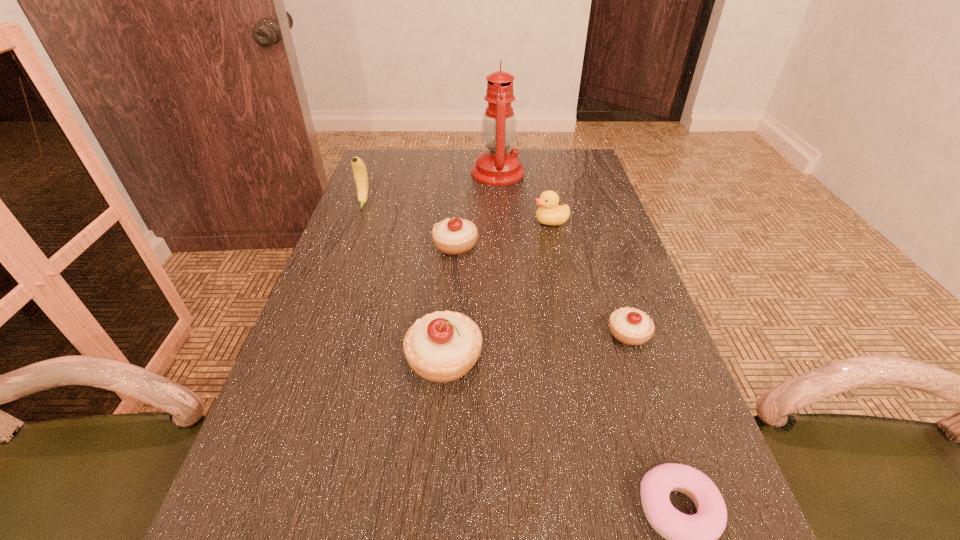
Find the location of a particular element. This screenshot has width=960, height=540. the sixth tallest object is located at coordinates (630, 326).

Where is `the smallest beige pastry`? The width and height of the screenshot is (960, 540). the smallest beige pastry is located at coordinates (630, 326).

Where is `free space located on the front of the tallest object`? Image resolution: width=960 pixels, height=540 pixels. free space located on the front of the tallest object is located at coordinates (500, 206).

Find the location of `vacant area situated 0.360m from the stem of the banana`. vacant area situated 0.360m from the stem of the banana is located at coordinates (329, 296).

The width and height of the screenshot is (960, 540). What are the coordinates of `vacant space located on the front of the fifth shortest object` in the screenshot? It's located at (439, 430).

The height and width of the screenshot is (540, 960). What are the coordinates of `free space located on the face of the yellow duckling` in the screenshot? It's located at (391, 221).

At what (x,y) coordinates should I click in order to perform the action: click on vacant space located 0.240m on the face of the yellow duckling. Please return your answer as a coordinate pair (x, y). Looking at the image, I should click on (447, 221).

The height and width of the screenshot is (540, 960). What are the coordinates of `free point located on the face of the yellow duckling` in the screenshot? It's located at (441, 221).

Where is `vacant space located on the back of the farthest pastry`? This screenshot has width=960, height=540. vacant space located on the back of the farthest pastry is located at coordinates (457, 221).

Locate an element on the screen. The width and height of the screenshot is (960, 540). vacant point located on the back of the second shortest object is located at coordinates (594, 233).